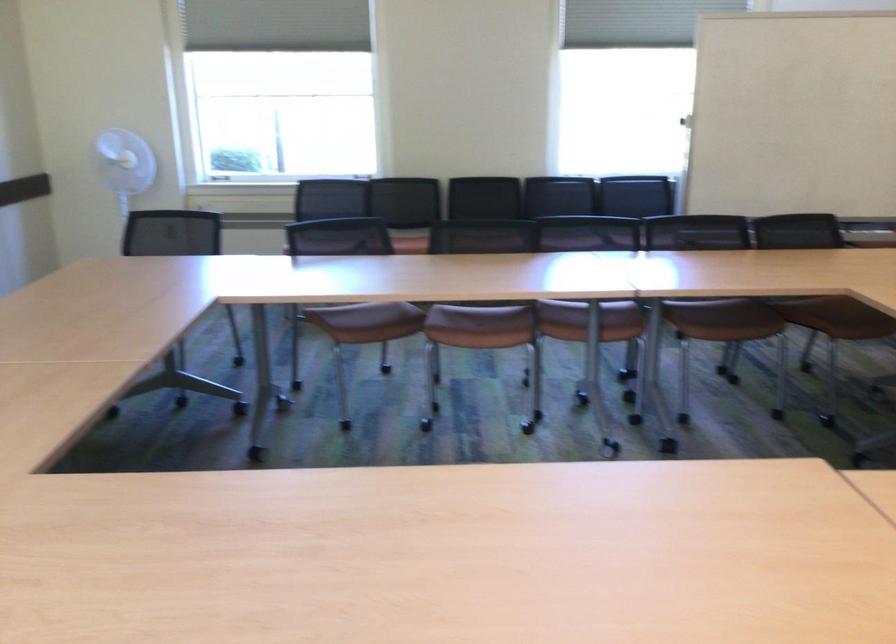
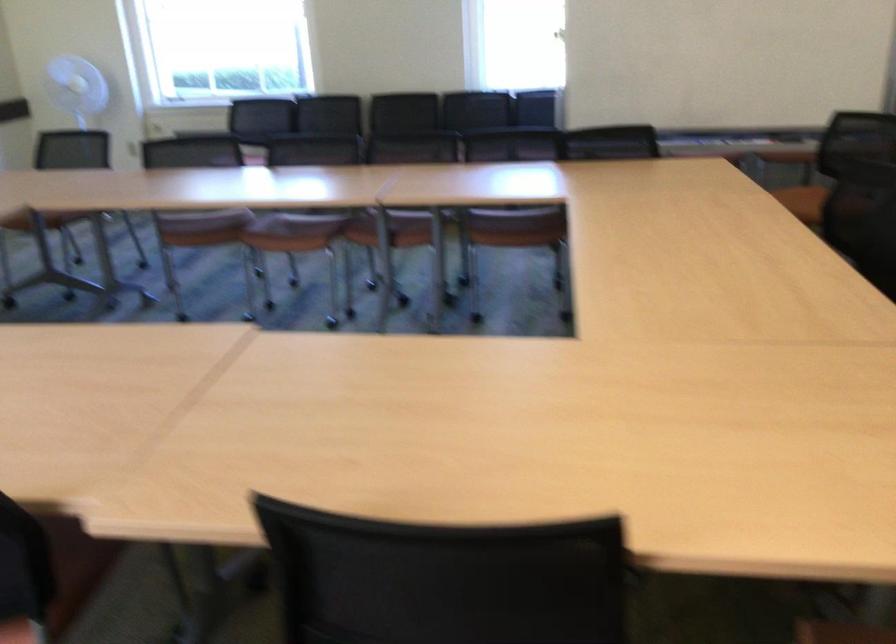
Find the pixel in the second image that matches (x=586, y=328) in the first image.

(391, 230)